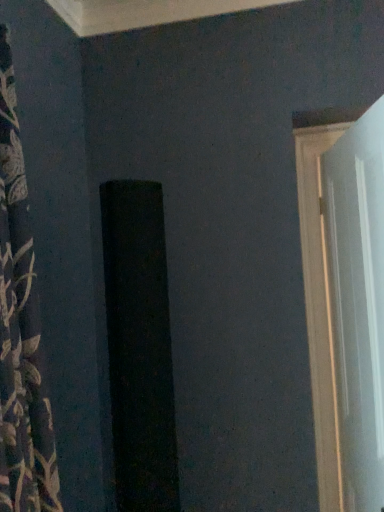
Question: Relative to floral fabric curtain at left, is white glossy door at right in front or behind?

Choices:
 (A) front
 (B) behind

Answer: (B)

Question: Based on their positions, is white glossy door at right located to the left or right of floral fabric curtain at left?

Choices:
 (A) left
 (B) right

Answer: (B)

Question: Considering the positions of point (326, 233) and point (39, 479), is point (326, 233) closer or farther from the camera than point (39, 479)?

Choices:
 (A) farther
 (B) closer

Answer: (A)

Question: In the image, is floral fabric curtain at left on the left side or the right side of white glossy door at right?

Choices:
 (A) left
 (B) right

Answer: (A)

Question: From the image's perspective, relative to white glossy door at right, is floral fabric curtain at left above or below?

Choices:
 (A) above
 (B) below

Answer: (A)

Question: Considering their positions, is floral fabric curtain at left located in front of or behind white glossy door at right?

Choices:
 (A) behind
 (B) front

Answer: (B)

Question: Is point (41, 367) closer or farther from the camera than point (352, 262)?

Choices:
 (A) farther
 (B) closer

Answer: (B)